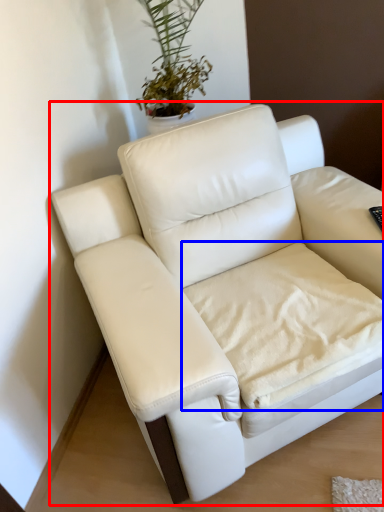
Question: Which of the following is the farthest to the observer, studio couch (highlighted by a red box) or sheet (highlighted by a blue box)?

Choices:
 (A) studio couch
 (B) sheet

Answer: (B)